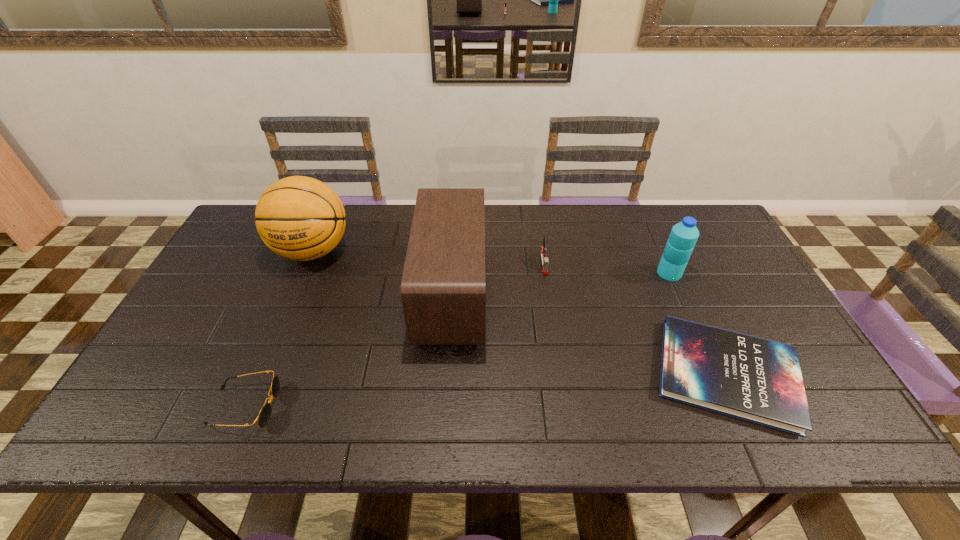
The height and width of the screenshot is (540, 960). Find the location of `object at the near right corner`. object at the near right corner is located at coordinates (758, 380).

The height and width of the screenshot is (540, 960). Find the location of `vacant area at the far edge of the desktop`. vacant area at the far edge of the desktop is located at coordinates (353, 241).

Identify the location of free space at the near edge. (383, 411).

I want to click on vacant space at the left edge, so click(195, 366).

In the image, there is a desktop. Find the location of `vacant space at the far left corner`. vacant space at the far left corner is located at coordinates (252, 227).

At what (x,y) coordinates should I click in order to perform the action: click on free space between the basketball and the fourth shortest object. Please return your answer as a coordinate pair (x, y). The image size is (960, 540). Looking at the image, I should click on (491, 262).

Locate an element on the screen. Image resolution: width=960 pixels, height=540 pixels. free space between the sunglasses and the third object from right to left is located at coordinates (395, 335).

The image size is (960, 540). In order to click on vacant area between the radio receiver and the sunglasses in this screenshot , I will do `click(348, 350)`.

Where is `vacant space in between the water bottle and the fourth object from right to left`? The height and width of the screenshot is (540, 960). vacant space in between the water bottle and the fourth object from right to left is located at coordinates (561, 283).

Find the location of a particular element. The width and height of the screenshot is (960, 540). blank region between the radio receiver and the water bottle is located at coordinates (561, 283).